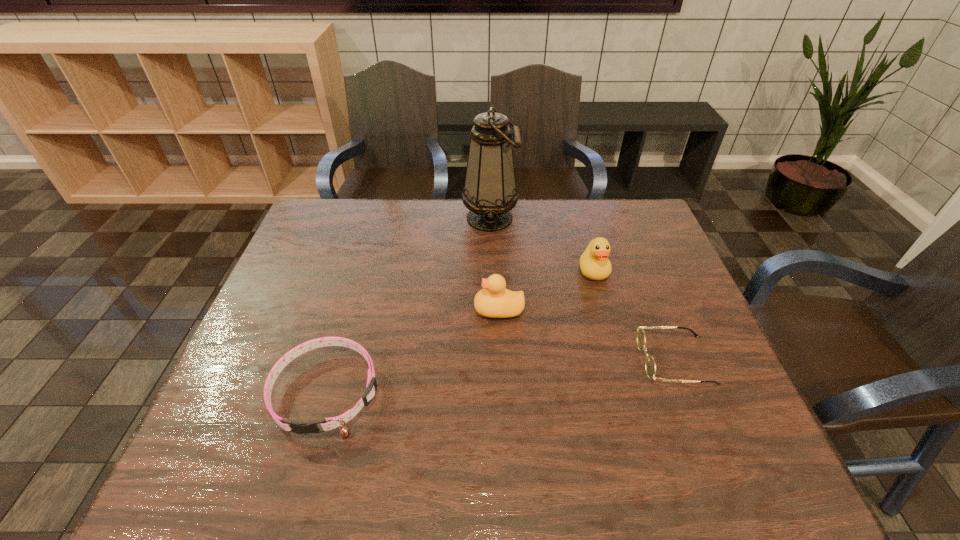
This screenshot has height=540, width=960. What are the coordinates of `the tallest object` in the screenshot? It's located at (489, 193).

Image resolution: width=960 pixels, height=540 pixels. I want to click on oil lamp, so click(489, 193).

Find the location of a particular element. the fourth object from left to right is located at coordinates (594, 264).

Find the location of a particular element. the right duck is located at coordinates (594, 264).

This screenshot has height=540, width=960. Find the location of `the third nearest object`. the third nearest object is located at coordinates click(x=494, y=301).

You are a GUI agent. You are given a task and a screenshot of the screen. Output one action in this format:
    pyautogui.click(x=<x>, y=<y>)
    Task: Click on the nearer duck
    
    Given the screenshot: What is the action you would take?
    pyautogui.click(x=494, y=301)

Where is `dog collar`? Image resolution: width=960 pixels, height=540 pixels. dog collar is located at coordinates (327, 424).

What are the coordinates of `spectacles` in the screenshot? It's located at (650, 367).

At what (x,y) coordinates should I click in order to perform the action: click on the rightmost object. Please return your answer as a coordinate pair (x, y). This screenshot has height=540, width=960. Looking at the image, I should click on (650, 367).

The height and width of the screenshot is (540, 960). I want to click on free space located 0.190m on the left of the tallest object, so click(x=405, y=218).